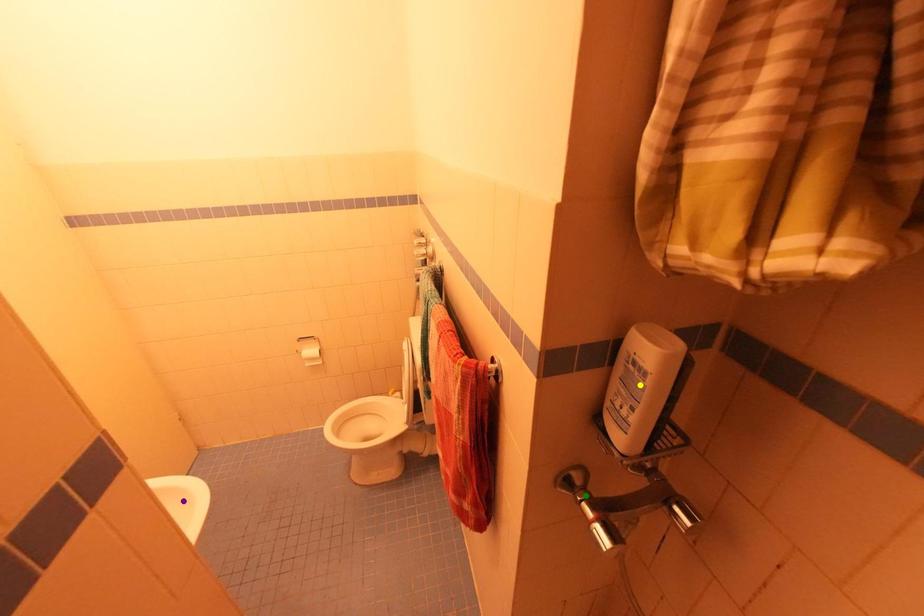
Order these from nearest to farthest:
- green point
- yellow point
- purple point

purple point, green point, yellow point